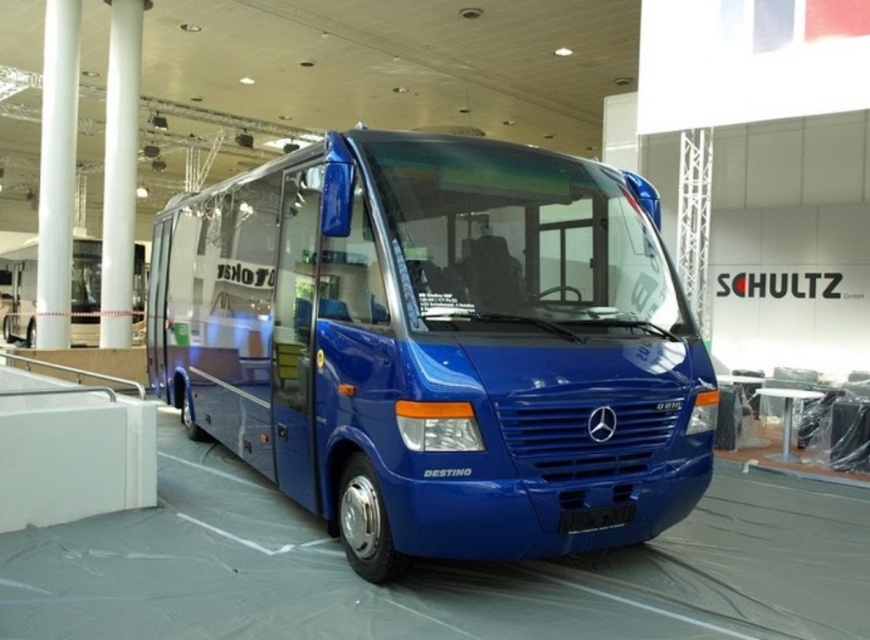
You are standing in the exhibition hall and want to find the glossy blue bus at center. Based on its 2D coordinates, which are at point 0.541, 0.505, where should you look relative to the exhibition hall?

The glossy blue bus at center is located at the coordinates (438, 346), which places it near the center of the exhibition hall.

You are attending a trade show and notice two white glossy pillars. One is labeled as the white glossy pillar at left and the other as the white glossy pillar at center. If you are standing facing the blue Mercedes Benz Destino bus, which pillar would be on your left side?

The white glossy pillar at left is positioned to the left of the white glossy pillar at center. When facing the blue Mercedes Benz Destino bus, the white glossy pillar at left would be on your left side.

You are an architect inspecting the exhibition hall. You notice the white glossy pillar at left and the white glossy pillar at center. Which pillar has a greater width?

The white glossy pillar at left has a greater width than the white glossy pillar at center.